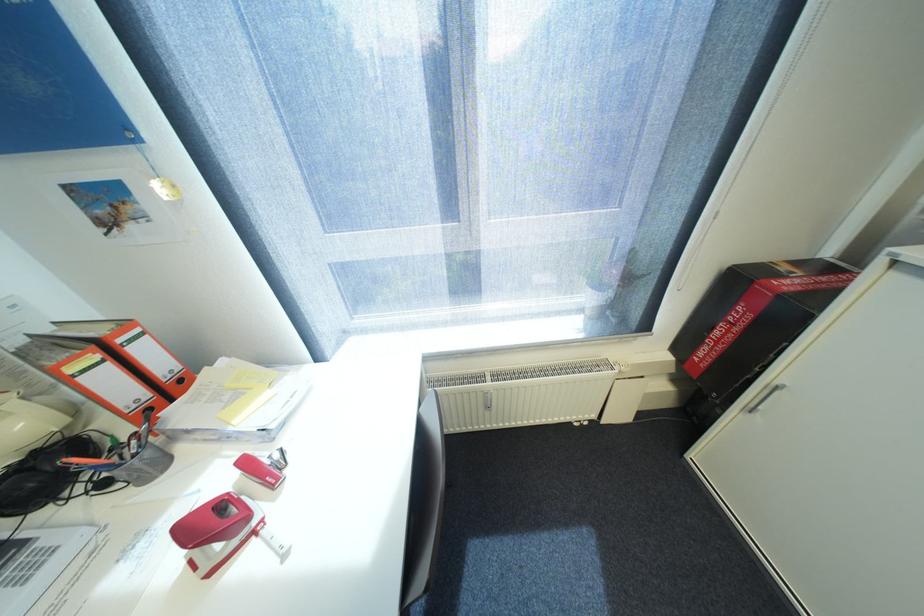
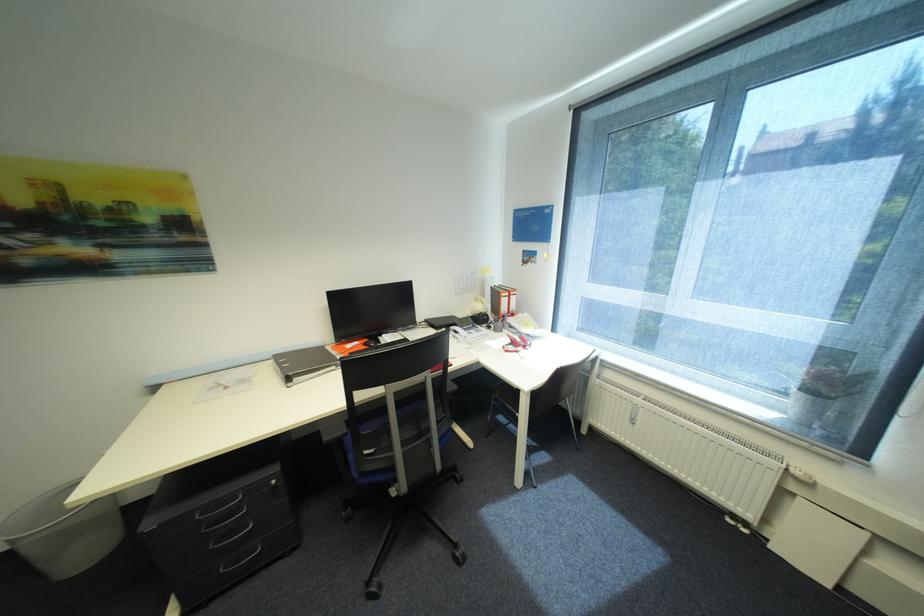
Where in the second image is the point corresponding to (x=112, y=485) from the first image?

(496, 328)